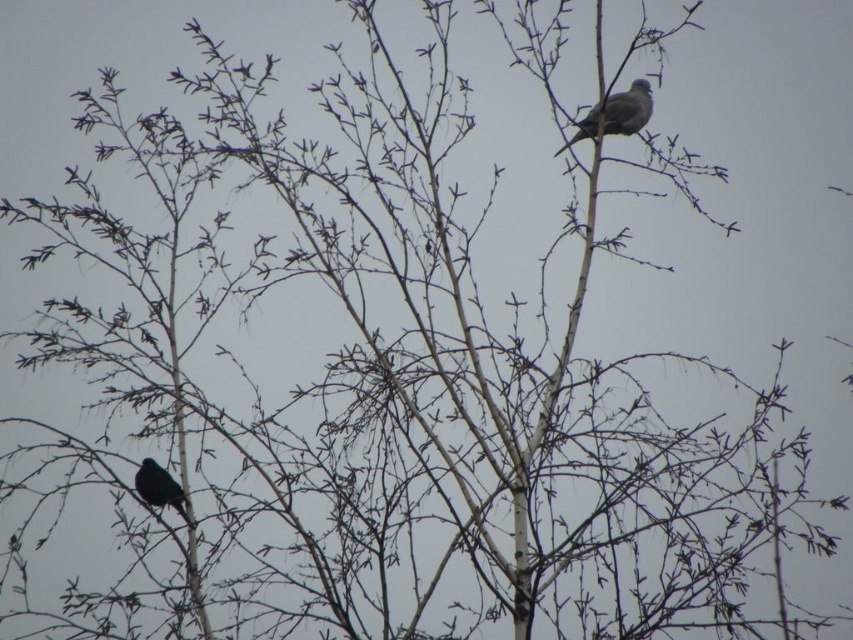
You are an ornithologist observing the two birds in the image. Which bird is bigger between the gray matte bird at upper center and the shiny black bird at lower left?

The gray matte bird at upper center is larger than the shiny black bird at lower left according to the description.

You are a birdwatcher trying to locate the gray matte bird at upper center in the image. Based on the coordinates provided, where exactly should you look on the image to find it?

The gray matte bird at upper center is located at coordinates point (x=616, y=113), so you should look near the upper center area of the image to find it.

You are a birdwatcher observing the scene. You notice two birds on the tree branches. Which bird is positioned higher up in the tree, the gray matte bird at upper center or the shiny black bird at lower left?

The gray matte bird at upper center is positioned higher up in the tree than the shiny black bird at lower left.